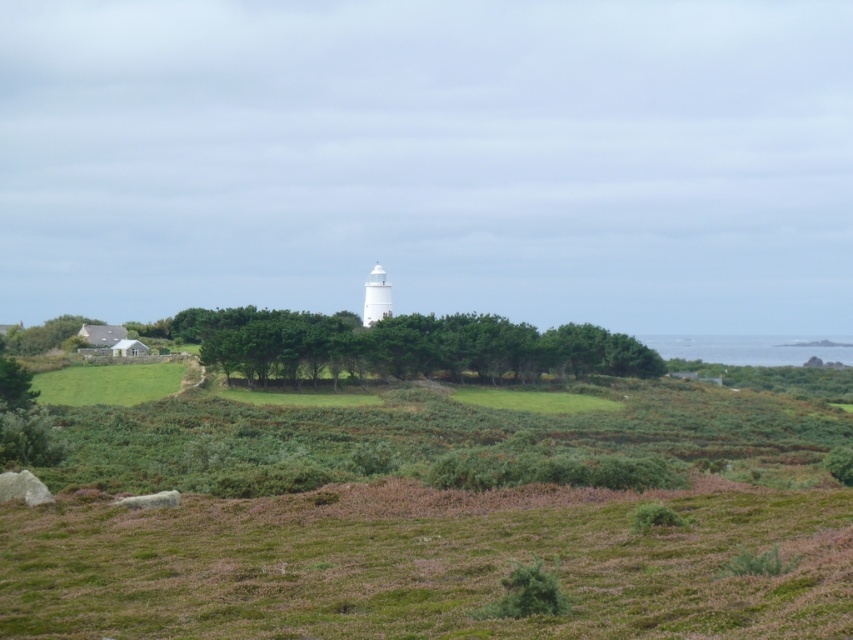
You are a hiker trying to find a spot to set up your tent. You see the green grassy field at lower left and the green leafy tree at lower left. Which area has more space for your tent?

The green grassy field at lower left is smaller than the green leafy tree at lower left, so the tree area might have more space for your tent.

Consider the image. You are a hiker trying to reach the sea from your current position. You notice two landmarks in the image provided by the scene description. The first is the cluster of green leafy trees at center, and the second is the green leafy tree at lower left. Which of these landmarks is closer to the sea?

The green leafy tree at lower left is closer to the sea because it is positioned at the lower left, which is typically the foreground in such landscapes, whereas the green leafy trees at center are in the middle ground, further away from the sea in the background.

You are an environmental scientist assessing the coastal area. You notice the green leafy trees at center and the green leafy tree at lower left. Which tree group has a smaller size?

The green leafy trees at center is smaller than the green leafy tree at lower left.